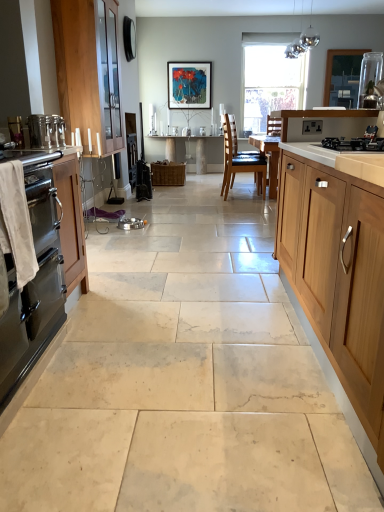
Question: Is wooden cabinet at left, the first cabinetry from the left, bigger than satin silver toaster at left, which is the second appliance in top-to-bottom order?

Choices:
 (A) no
 (B) yes

Answer: (B)

Question: From a real-world perspective, is wooden cabinet at left, marked as the third cabinetry in a front-to-back arrangement, located higher than satin silver toaster at left, marked as the 2th appliance in a right-to-left arrangement?

Choices:
 (A) yes
 (B) no

Answer: (A)

Question: Is wooden cabinet at left, acting as the third cabinetry starting from the right, oriented away from satin silver toaster at left, the second appliance positioned from the bottom?

Choices:
 (A) no
 (B) yes

Answer: (A)

Question: Can you confirm if wooden cabinet at left, the first cabinetry from the left, is wider than satin silver toaster at left, the second appliance positioned from the bottom?

Choices:
 (A) yes
 (B) no

Answer: (A)

Question: Can you confirm if wooden cabinet at left, the first cabinetry from the left, is positioned to the left of satin silver toaster at left, which ranks as the second appliance in left-to-right order?

Choices:
 (A) no
 (B) yes

Answer: (B)

Question: Visually, is glossy metallic light fixture at upper center positioned to the left or to the right of transparent glass window at center?

Choices:
 (A) right
 (B) left

Answer: (B)

Question: From a real-world perspective, is glossy metallic light fixture at upper center physically located above or below transparent glass window at center?

Choices:
 (A) below
 (B) above

Answer: (B)

Question: Does point (309, 35) appear closer or farther from the camera than point (281, 81)?

Choices:
 (A) closer
 (B) farther

Answer: (A)

Question: From their relative heights in the image, would you say glossy metallic light fixture at upper center is taller or shorter than transparent glass window at center?

Choices:
 (A) short
 (B) tall

Answer: (A)

Question: Considering their positions, is satin silver countertop at left located in front of or behind clear glass jar at upper right?

Choices:
 (A) front
 (B) behind

Answer: (A)

Question: From a real-world perspective, is satin silver countertop at left physically located above or below clear glass jar at upper right?

Choices:
 (A) above
 (B) below

Answer: (B)

Question: Is satin silver countertop at left wider or thinner than clear glass jar at upper right?

Choices:
 (A) wide
 (B) thin

Answer: (A)

Question: From their relative heights in the image, would you say satin silver countertop at left is taller or shorter than clear glass jar at upper right?

Choices:
 (A) short
 (B) tall

Answer: (A)

Question: From their relative heights in the image, would you say glossy metallic light fixture at upper center is taller or shorter than metallic stainless steel oven at left, marked as the 1th appliance in a left-to-right arrangement?

Choices:
 (A) tall
 (B) short

Answer: (A)

Question: Considering their positions, is glossy metallic light fixture at upper center located in front of or behind metallic stainless steel oven at left, arranged as the second appliance when viewed from the back?

Choices:
 (A) behind
 (B) front

Answer: (A)